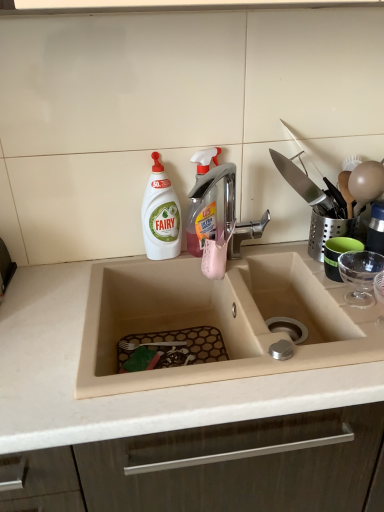
Question: From the image's perspective, does white plastic bottle at upper left, positioned as the first cleaning product in left-to-right order, appear higher than beige matte sink at center?

Choices:
 (A) yes
 (B) no

Answer: (A)

Question: Considering the relative positions of white plastic bottle at upper left, positioned as the first cleaning product in left-to-right order, and beige matte sink at center in the image provided, is white plastic bottle at upper left, positioned as the first cleaning product in left-to-right order, in front of beige matte sink at center?

Choices:
 (A) yes
 (B) no

Answer: (B)

Question: From the image's perspective, does white plastic bottle at upper left, positioned as the first cleaning product in left-to-right order, appear lower than beige matte sink at center?

Choices:
 (A) no
 (B) yes

Answer: (A)

Question: From a real-world perspective, is white plastic bottle at upper left, which is counted as the second cleaning product, starting from the right, positioned over beige matte sink at center based on gravity?

Choices:
 (A) no
 (B) yes

Answer: (B)

Question: Is there a large distance between white plastic bottle at upper left, which is counted as the second cleaning product, starting from the right, and beige matte sink at center?

Choices:
 (A) yes
 (B) no

Answer: (B)

Question: From the image's perspective, is white plastic bottle at upper left, positioned as the first cleaning product in left-to-right order, located above or below translucent plastic spray bottle at upper center, marked as the 2th cleaning product in a left-to-right arrangement?

Choices:
 (A) above
 (B) below

Answer: (B)

Question: Considering the relative positions of white plastic bottle at upper left, which is counted as the second cleaning product, starting from the right, and translucent plastic spray bottle at upper center, acting as the 1th cleaning product starting from the right, in the image provided, is white plastic bottle at upper left, which is counted as the second cleaning product, starting from the right, to the left or to the right of translucent plastic spray bottle at upper center, acting as the 1th cleaning product starting from the right,?

Choices:
 (A) right
 (B) left

Answer: (B)

Question: From a real-world perspective, is white plastic bottle at upper left, which is counted as the second cleaning product, starting from the right, positioned above or below translucent plastic spray bottle at upper center, acting as the 1th cleaning product starting from the right?

Choices:
 (A) below
 (B) above

Answer: (A)

Question: In the image, is white plastic bottle at upper left, positioned as the first cleaning product in left-to-right order, positioned in front of or behind translucent plastic spray bottle at upper center, acting as the 1th cleaning product starting from the right?

Choices:
 (A) behind
 (B) front

Answer: (B)

Question: Is translucent plastic spray bottle at upper center, acting as the 1th cleaning product starting from the right, wider or thinner than white plastic bottle at upper left, which is counted as the second cleaning product, starting from the right?

Choices:
 (A) wide
 (B) thin

Answer: (B)

Question: From a real-world perspective, is translucent plastic spray bottle at upper center, marked as the 2th cleaning product in a left-to-right arrangement, positioned above or below white plastic bottle at upper left, which is counted as the second cleaning product, starting from the right?

Choices:
 (A) above
 (B) below

Answer: (A)

Question: Considering the positions of point (216, 188) and point (152, 184), is point (216, 188) closer or farther from the camera than point (152, 184)?

Choices:
 (A) farther
 (B) closer

Answer: (A)

Question: In terms of height, does translucent plastic spray bottle at upper center, marked as the 2th cleaning product in a left-to-right arrangement, look taller or shorter compared to white plastic bottle at upper left, positioned as the first cleaning product in left-to-right order?

Choices:
 (A) short
 (B) tall

Answer: (A)

Question: From the image's perspective, is translucent plastic spray bottle at upper center, acting as the 1th cleaning product starting from the right, positioned above or below beige matte sink at center?

Choices:
 (A) above
 (B) below

Answer: (A)

Question: Looking at the image, does translucent plastic spray bottle at upper center, acting as the 1th cleaning product starting from the right, seem bigger or smaller compared to beige matte sink at center?

Choices:
 (A) big
 (B) small

Answer: (B)